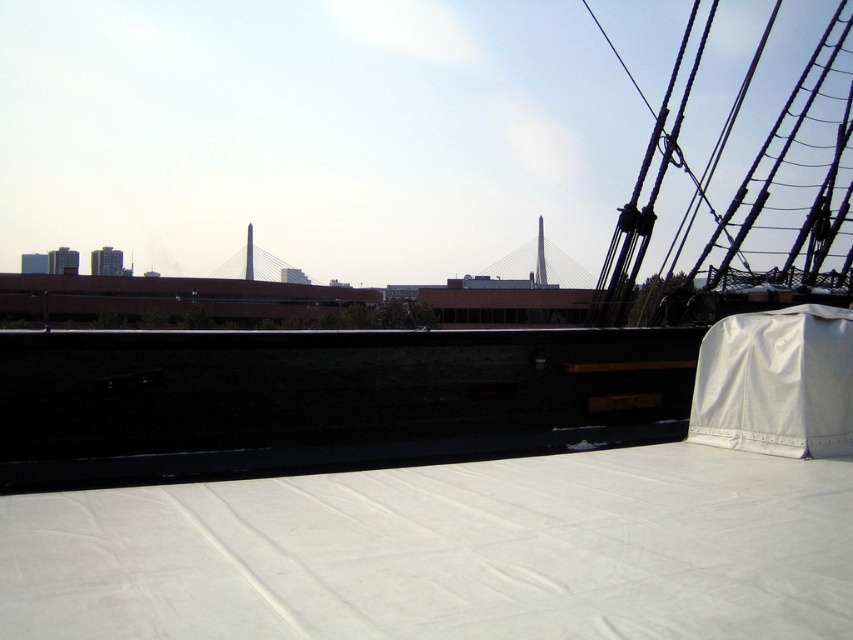
You are standing on the deck of the ship and notice two points marked in the scene. The first point is at coordinates point [99,554] and the second is at point [773,442]. Which point is closer to you as you stand on the deck?

Point [99,554] is closer to you because it is in front of point [773,442].

You are standing on the ship deck and need to cover a small table. You have the white matte sheet at lower center and the white fabric cover at upper right. Which one is taller and better suited for covering the table?

The white fabric cover at upper right is taller than the white matte sheet at lower center, making it better suited for covering the table.

You are standing on the deck of the ship and want to place a heavy box on the white matte sheet at lower center. However, there is a white fabric cover at upper right above it. Will the box be visible from the upper right area?

The white matte sheet at lower center is below the white fabric cover at upper right, so the box placed on the white matte sheet at lower center would be partially or fully obscured by the white fabric cover at upper right, making it less visible from the upper right area.